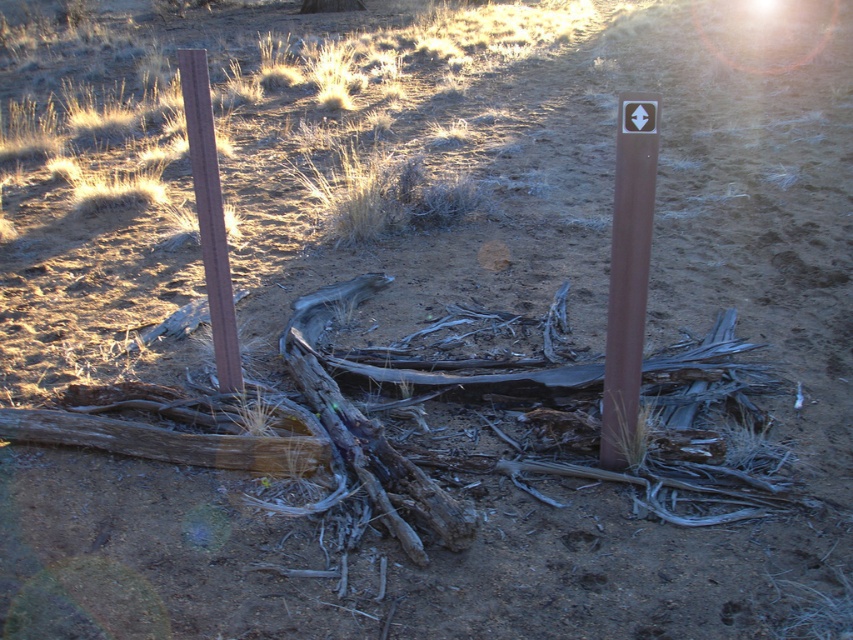
Between brown matte post at center and brown wood post at left, which one has less height?

brown matte post at center is shorter.

Which is below, brown matte post at center or brown wood post at left?

Positioned lower is brown matte post at center.

This screenshot has width=853, height=640. Identify the location of brown matte post at center. (628, 275).